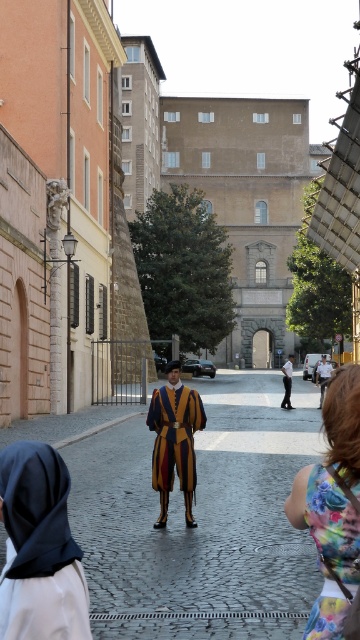
Is dark blue fabric headscarf at lower left shorter than floral fabric dress at lower right?

Correct, dark blue fabric headscarf at lower left is not as tall as floral fabric dress at lower right.

Does dark blue fabric headscarf at lower left have a greater width compared to floral fabric dress at lower right?

Yes, dark blue fabric headscarf at lower left is wider than floral fabric dress at lower right.

What do you see at coordinates (39, 548) in the screenshot? I see `dark blue fabric headscarf at lower left` at bounding box center [39, 548].

You are a GUI agent. You are given a task and a screenshot of the screen. Output one action in this format:
    pyautogui.click(x=<x>, y=<y>)
    Task: Click on the dark blue fabric headscarf at lower left
    This screenshot has height=640, width=360.
    Given the screenshot: What is the action you would take?
    pyautogui.click(x=39, y=548)

Between dark blue fabric headscarf at lower left and velvet yellow and purple robe at center, which one is positioned higher?

Positioned higher is dark blue fabric headscarf at lower left.

Which is more to the left, dark blue fabric headscarf at lower left or velvet yellow and purple robe at center?

Positioned to the left is dark blue fabric headscarf at lower left.

I want to click on dark blue fabric headscarf at lower left, so click(x=39, y=548).

Can you confirm if dark blue fabric headscarf at lower left is bigger than floral dress at lower right?

Incorrect, dark blue fabric headscarf at lower left is not larger than floral dress at lower right.

Is dark blue fabric headscarf at lower left smaller than floral dress at lower right?

Correct, dark blue fabric headscarf at lower left occupies less space than floral dress at lower right.

Which is in front, point (20, 595) or point (325, 500)?

Point (20, 595) is more forward.

Where is `dark blue fabric headscarf at lower left`? The image size is (360, 640). dark blue fabric headscarf at lower left is located at coordinates (x=39, y=548).